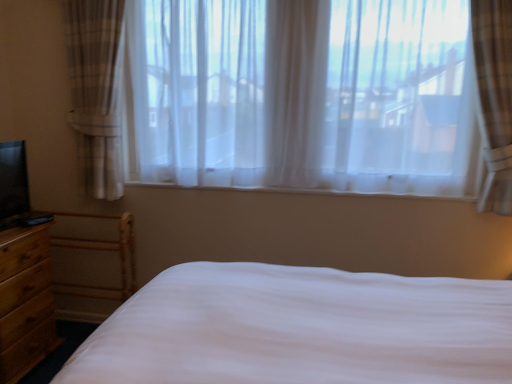
Question: From a real-world perspective, is sheer white curtains at center physically below brown wood nightstand at lower left?

Choices:
 (A) no
 (B) yes

Answer: (A)

Question: Is sheer white curtains at center shorter than brown wood nightstand at lower left?

Choices:
 (A) no
 (B) yes

Answer: (A)

Question: Does sheer white curtains at center turn towards brown wood nightstand at lower left?

Choices:
 (A) no
 (B) yes

Answer: (A)

Question: Are sheer white curtains at center and brown wood nightstand at lower left far apart?

Choices:
 (A) yes
 (B) no

Answer: (A)

Question: Considering the relative positions of sheer white curtains at center and brown wood nightstand at lower left in the image provided, is sheer white curtains at center to the left of brown wood nightstand at lower left from the viewer's perspective?

Choices:
 (A) no
 (B) yes

Answer: (A)

Question: Can you confirm if sheer white curtains at center is smaller than brown wood nightstand at lower left?

Choices:
 (A) yes
 (B) no

Answer: (B)

Question: Is the surface of brown wood nightstand at lower left in direct contact with sheer white curtains at center?

Choices:
 (A) no
 (B) yes

Answer: (A)

Question: Can you confirm if brown wood nightstand at lower left is thinner than sheer white curtains at center?

Choices:
 (A) yes
 (B) no

Answer: (B)

Question: Can you confirm if brown wood nightstand at lower left is wider than sheer white curtains at center?

Choices:
 (A) yes
 (B) no

Answer: (A)

Question: Is sheer white curtains at center at the back of brown wood nightstand at lower left?

Choices:
 (A) no
 (B) yes

Answer: (A)

Question: From the image's perspective, is brown wood nightstand at lower left beneath sheer white curtains at center?

Choices:
 (A) yes
 (B) no

Answer: (A)

Question: Can you confirm if brown wood nightstand at lower left is shorter than sheer white curtains at center?

Choices:
 (A) yes
 (B) no

Answer: (A)

Question: Considering the relative positions of brown wood nightstand at lower left and sheer white curtains at center in the image provided, is brown wood nightstand at lower left to the left or to the right of sheer white curtains at center?

Choices:
 (A) left
 (B) right

Answer: (A)